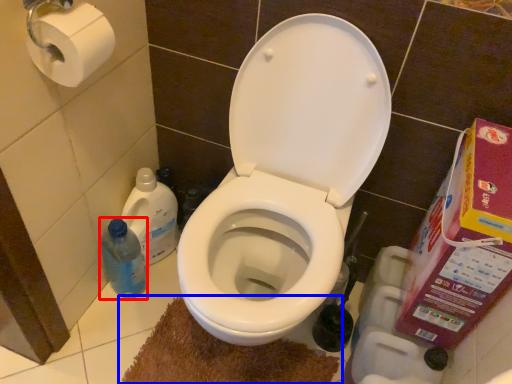
Question: Which object is further to the camera taking this photo, cleaning product (highlighted by a red box) or bath mat (highlighted by a blue box)?

Choices:
 (A) cleaning product
 (B) bath mat

Answer: (A)